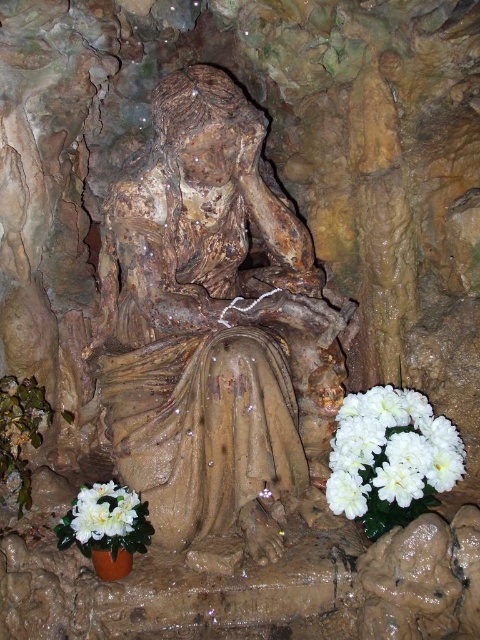
Question: Considering the relative positions of white matte flower at lower right and white artificial flowers at lower left in the image provided, where is white matte flower at lower right located with respect to white artificial flowers at lower left?

Choices:
 (A) left
 (B) right

Answer: (B)

Question: Can you confirm if brown stone statue at center is positioned below white artificial flowers at lower left?

Choices:
 (A) yes
 (B) no

Answer: (B)

Question: Which point appears farthest from the camera in this image?

Choices:
 (A) (133, 552)
 (B) (210, 520)

Answer: (B)

Question: Which point is farther from the camera taking this photo?

Choices:
 (A) (415, 420)
 (B) (182, 396)
 (C) (123, 518)

Answer: (A)

Question: Does brown stone statue at center lie in front of white silk flower at lower left?

Choices:
 (A) no
 (B) yes

Answer: (B)

Question: Which of the following is the farthest from the observer?

Choices:
 (A) white matte flower at lower right
 (B) white silk flower at lower left

Answer: (A)